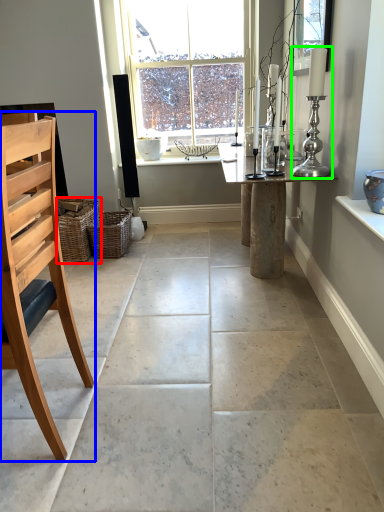
Question: Which is farther away from basket (highlighted by a red box)? chair (highlighted by a blue box) or candle holder (highlighted by a green box)?

Choices:
 (A) chair
 (B) candle holder

Answer: (B)